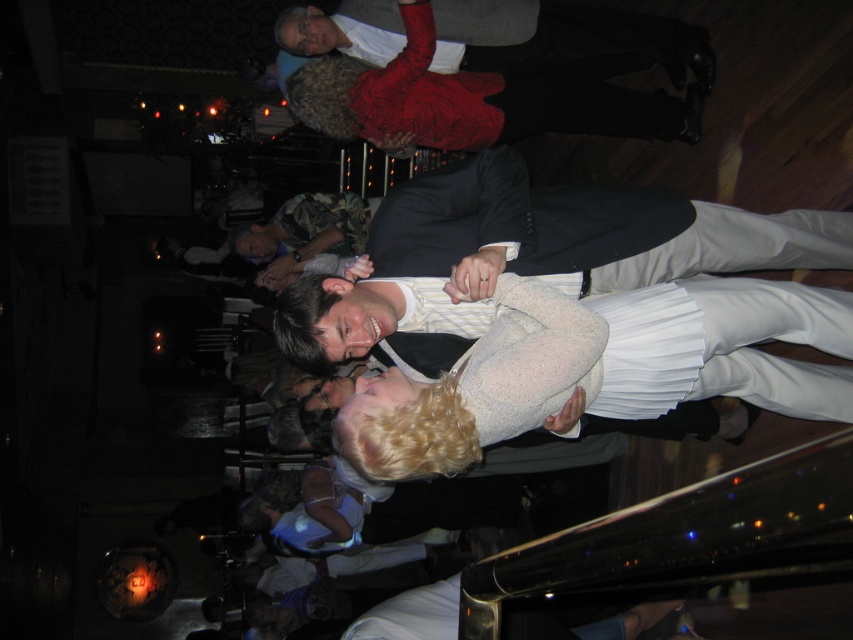
Can you confirm if white pleated dress at center is positioned to the right of matte white shirt at upper center?

Correct, you'll find white pleated dress at center to the right of matte white shirt at upper center.

The image size is (853, 640). What do you see at coordinates (596, 368) in the screenshot?
I see `white pleated dress at center` at bounding box center [596, 368].

Who is more distant from viewer, (x=793, y=321) or (x=466, y=61)?

Positioned behind is point (x=466, y=61).

In order to click on white pleated dress at center in this screenshot , I will do `click(596, 368)`.